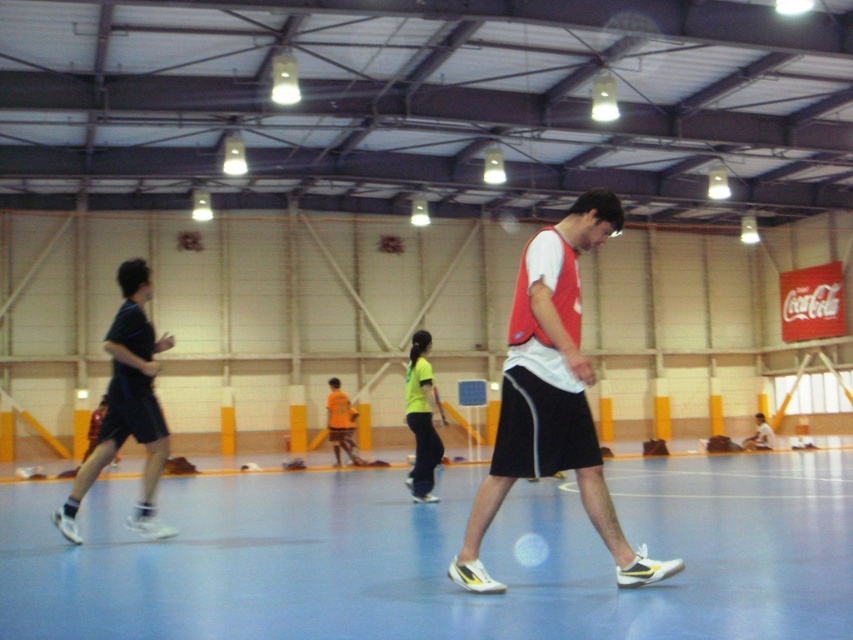
How much distance is there between matte red vest at center and neon yellow jersey at center?

matte red vest at center is 5.33 meters from neon yellow jersey at center.

Does point (570, 342) come farther from viewer compared to point (439, 456)?

No, it is not.

This screenshot has height=640, width=853. What are the coordinates of `matte red vest at center` in the screenshot? It's located at (550, 396).

Consider the image. Measure the distance from dark blue fabric shorts at left to neon yellow jersey at center.

dark blue fabric shorts at left and neon yellow jersey at center are 5.23 meters apart.

From the picture: Does dark blue fabric shorts at left have a greater width compared to neon yellow jersey at center?

Correct, the width of dark blue fabric shorts at left exceeds that of neon yellow jersey at center.

What do you see at coordinates (126, 404) in the screenshot? The height and width of the screenshot is (640, 853). I see `dark blue fabric shorts at left` at bounding box center [126, 404].

The width and height of the screenshot is (853, 640). Find the location of `dark blue fabric shorts at left`. dark blue fabric shorts at left is located at coordinates (126, 404).

Can you confirm if blue rubber basketball court at center is wider than dark blue fabric shorts at left?

Yes.

What are the coordinates of `blue rubber basketball court at center` in the screenshot? It's located at (440, 556).

Where is `blue rubber basketball court at center`? This screenshot has height=640, width=853. blue rubber basketball court at center is located at coordinates (440, 556).